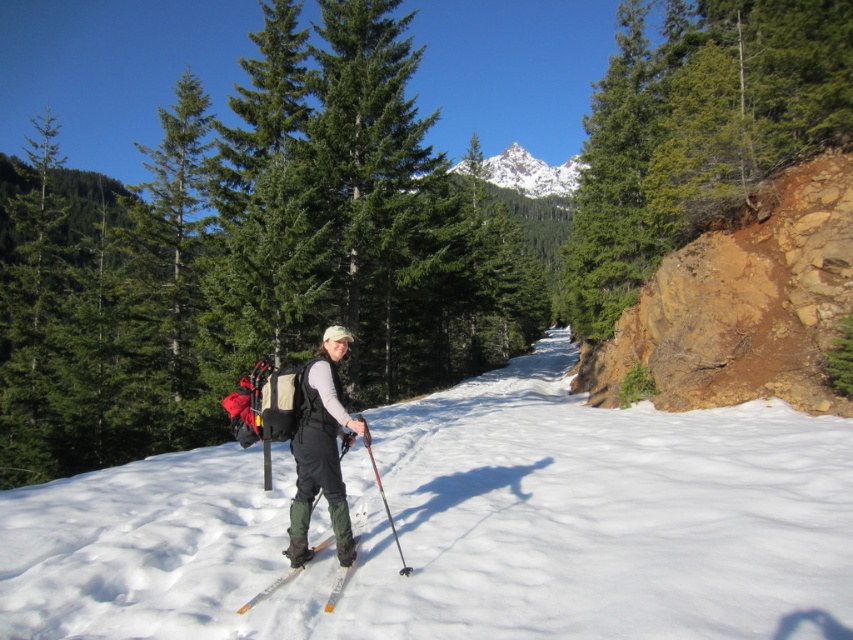
You are a photographer standing at the camera position. You want to take a photo of the green matte tree at center. If your camera has a maximum focus range of 20 meters, will you be able to capture the tree in focus?

The distance between the green matte tree at center and the camera is 19.47 meters, which is within the camera maximum focus range of 20 meters. Therefore, you can capture the tree in focus.

You are a photographer standing at the edge of a snowy forest trail. You want to capture a photo of the white snow at center while ensuring the tall evergreen trees on both sides of the trail are also in focus. Based on the scene description, what is the minimum distance you should set your camera focus to ensure both the snow and the trees are sharp?

The white snow at center is 4.08 meters from the camera. Since the trees are on both sides of the trail, they are likely further away than the snow. To ensure both the snow and trees are in focus, the camera should be focused at the hyperfocal distance, which would require calculating based on the snow distance and the depth of field. However, a simplified approach would be to focus approximately 4.08 meters away, as the trees are farther, ensuring the snow at 4.08 meters and beyond are in focus.

You are planning to build a snowman using the white snow at center and need to know if there is enough space between the green matte tree at center and the edge of the snow area. Can you determine if the snow area is narrower than the tree?

The white snow at center has a width less than the green matte tree at center, so yes, the snow area is narrower than the tree.